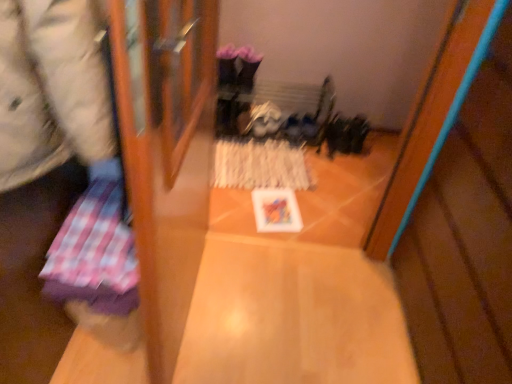
Identify the location of unoccupied region to the right of white textured paper at center, the 2th wrapping paper positioned from the left. (342, 180).